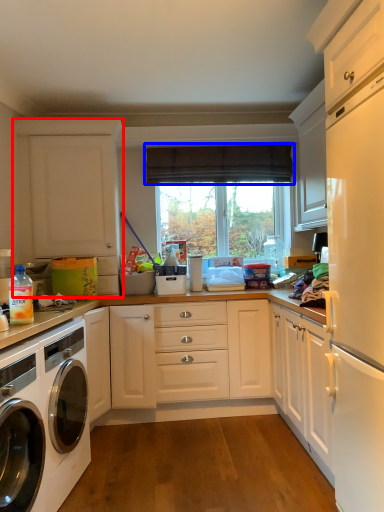
Question: Which object appears closest to the camera in this image, cabinetry (highlighted by a red box) or curtain (highlighted by a blue box)?

Choices:
 (A) cabinetry
 (B) curtain

Answer: (A)